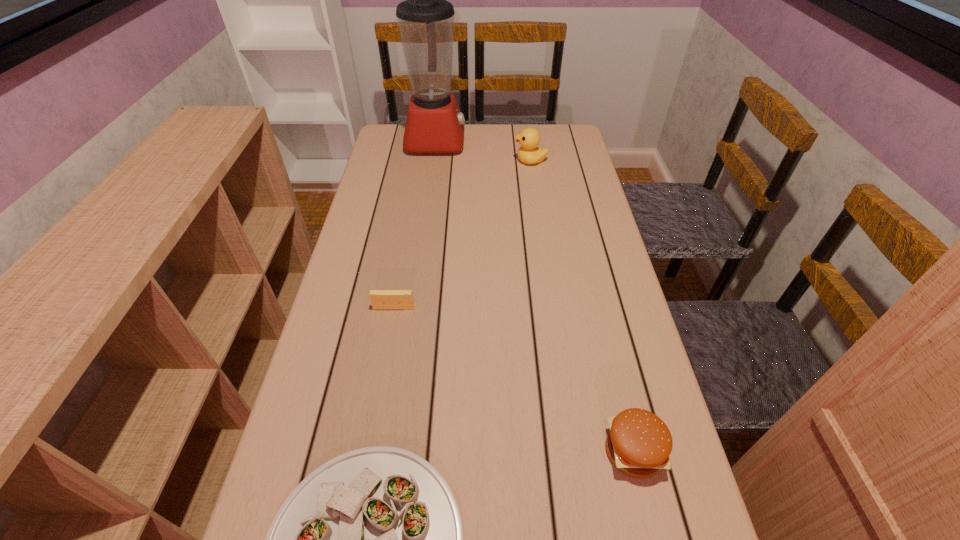
Where is `vacant space located on the left of the third shortest object`? vacant space located on the left of the third shortest object is located at coordinates (511, 451).

Locate an element on the screen. This screenshot has height=540, width=960. vacant space situated at the front of the third farthest object with spools is located at coordinates (375, 409).

Where is `blender at the far edge`? The width and height of the screenshot is (960, 540). blender at the far edge is located at coordinates (434, 124).

At what (x,y) coordinates should I click in order to perform the action: click on duck that is at the far edge. Please return your answer as a coordinate pair (x, y). Looking at the image, I should click on (529, 138).

You are a GUI agent. You are given a task and a screenshot of the screen. Output one action in this format:
    pyautogui.click(x=<x>, y=<y>)
    Task: Click on the blender located at the left edge
    The image size is (960, 540).
    Given the screenshot: What is the action you would take?
    pyautogui.click(x=434, y=124)

At what (x,y) coordinates should I click in order to perform the action: click on videotape that is positioned at the left edge. Please return your answer as a coordinate pair (x, y). Looking at the image, I should click on (380, 299).

The height and width of the screenshot is (540, 960). I want to click on duck positioned at the right edge, so click(x=529, y=138).

Find the location of a particular element. Image resolution: width=960 pixels, height=540 pixels. hamburger positioned at the right edge is located at coordinates (638, 443).

At what (x,y) coordinates should I click in order to perform the action: click on object at the far left corner. Please return your answer as a coordinate pair (x, y). The width and height of the screenshot is (960, 540). Looking at the image, I should click on (434, 124).

I want to click on object at the far right corner, so click(529, 138).